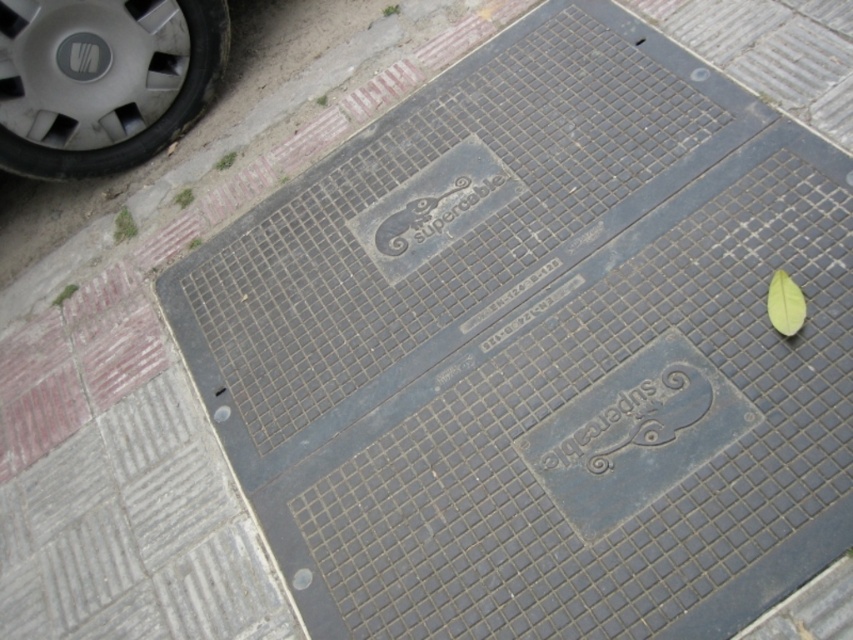
You are a delivery driver who needs to park your vehicle on the sidewalk near the manhole cover. The sidewalk has a metallic gray tire at upper left and a green matte leaf at upper right. Which object takes up more horizontal space?

The metallic gray tire at upper left takes up more horizontal space because its width is larger than the green matte leaf at upper right.